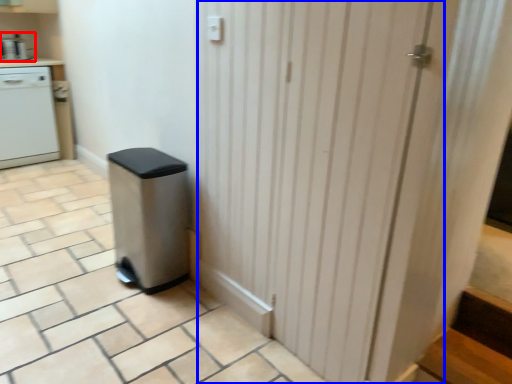
Question: Which point is closer to the camera, kitchen appliance (highlighted by a red box) or screen door (highlighted by a blue box)?

Choices:
 (A) kitchen appliance
 (B) screen door

Answer: (B)